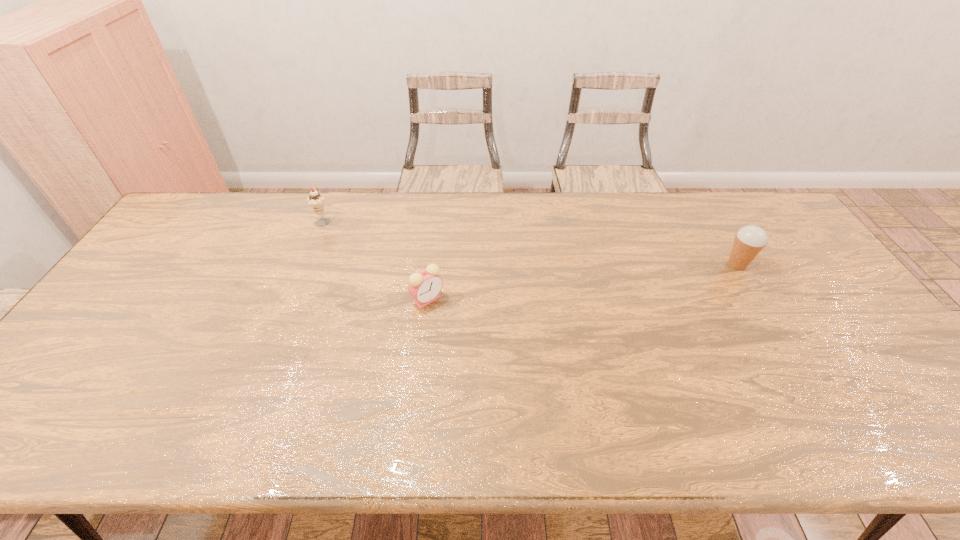
Find the location of a particular element. vacant space at the far edge of the desktop is located at coordinates (501, 193).

I want to click on free space at the near edge, so click(270, 439).

Locate an element on the screen. free space at the left edge of the desktop is located at coordinates (156, 282).

Find the location of `vacant space at the right edge of the desktop`. vacant space at the right edge of the desktop is located at coordinates (789, 264).

Where is `vacant space at the far left corner`? vacant space at the far left corner is located at coordinates (185, 213).

You are a GUI agent. You are given a task and a screenshot of the screen. Output one action in this format:
    pyautogui.click(x=<x>, y=<y>)
    Task: Click on the vacant space at the near right corner of the desktop
    The width and height of the screenshot is (960, 540).
    Given the screenshot: What is the action you would take?
    pyautogui.click(x=937, y=438)

Locate an element on the screen. empty space that is in between the second farthest object and the farthest object is located at coordinates (530, 242).

Identify the location of free space between the nearer icecream and the leftmost object. The image size is (960, 540). (530, 242).

You are a GUI agent. You are given a task and a screenshot of the screen. Output one action in this format:
    pyautogui.click(x=<x>, y=<y>)
    Task: Click on the free point between the rightmost object and the alarm clock
    
    Given the screenshot: What is the action you would take?
    pyautogui.click(x=583, y=282)

This screenshot has width=960, height=540. Find the location of `free point between the right icecream and the leftmost object`. free point between the right icecream and the leftmost object is located at coordinates (530, 242).